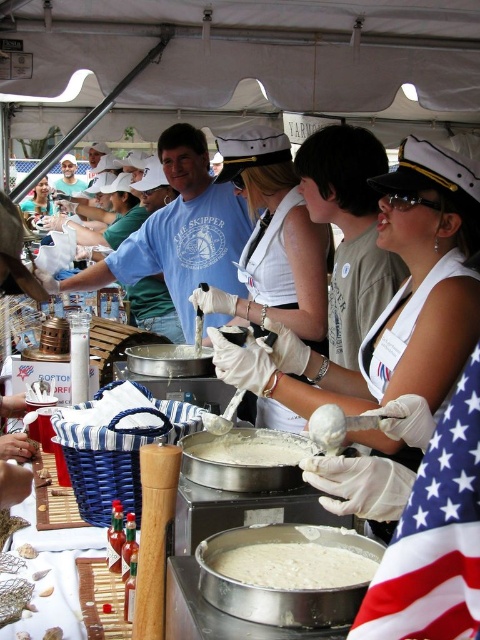
Question: Can you confirm if white creamy substance at center is bigger than matte white sailor hat at upper center?

Choices:
 (A) yes
 (B) no

Answer: (B)

Question: Which point is farther from the camera taking this photo?

Choices:
 (A) coord(350,576)
 (B) coord(188,451)
 (C) coord(225,296)

Answer: (C)

Question: Considering the real-world distances, which object is closest to the white matte gloves at center?

Choices:
 (A) white creamy batter at center
 (B) matte white sailor hat at upper center

Answer: (A)

Question: Is white matte gloves at center wider than white creamy batter at center?

Choices:
 (A) no
 (B) yes

Answer: (B)

Question: Which of the following is the closest to the observer?

Choices:
 (A) (368, 561)
 (B) (280, 436)
 (C) (313, 240)

Answer: (A)

Question: Can you confirm if white matte gloves at center is positioned above white creamy substance at center?

Choices:
 (A) no
 (B) yes

Answer: (B)